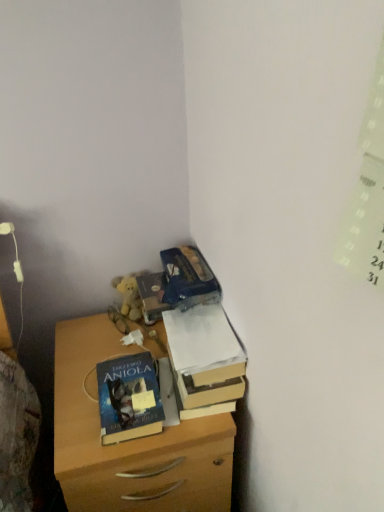
At what (x,y) coordinates should I click in order to perform the action: click on vacant space to the left of cardboard box at upper right. Please return your answer as a coordinate pair (x, y). The height and width of the screenshot is (512, 384). Looking at the image, I should click on click(x=104, y=360).